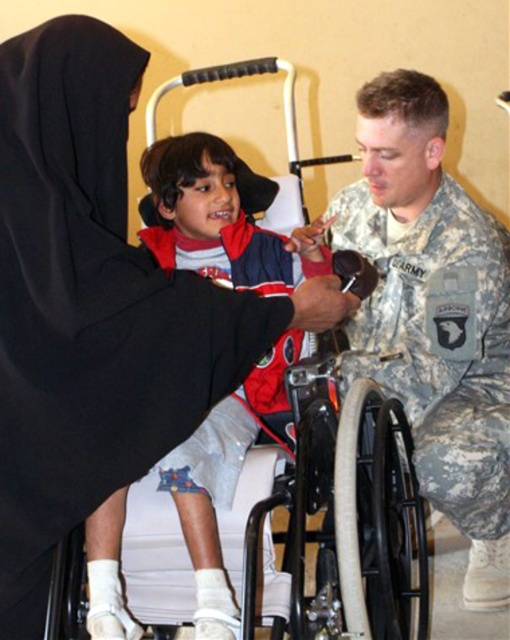
Is camouflage uniform at right below white plastic wheelchair at center?

No.

Where is `camouflage uniform at right`? This screenshot has width=510, height=640. camouflage uniform at right is located at coordinates (434, 314).

Is black fabric at upper left below white plastic wheelchair at center?

Actually, black fabric at upper left is above white plastic wheelchair at center.

Who is lower down, black fabric at upper left or white plastic wheelchair at center?

Positioned lower is white plastic wheelchair at center.

Image resolution: width=510 pixels, height=640 pixels. I want to click on black fabric at upper left, so click(95, 307).

At what (x,y) coordinates should I click in order to perform the action: click on black fabric at upper left. Please return your answer as a coordinate pair (x, y). The image size is (510, 640). Looking at the image, I should click on (95, 307).

Does black fabric at upper left have a smaller size compared to camouflage uniform at right?

Yes.

Is point (125, 268) in front of point (477, 339)?

Yes, point (125, 268) is in front of point (477, 339).

Does point (34, 54) come behind point (499, 396)?

No, it is in front of (499, 396).

Image resolution: width=510 pixels, height=640 pixels. In order to click on black fabric at upper left in this screenshot , I will do `click(95, 307)`.